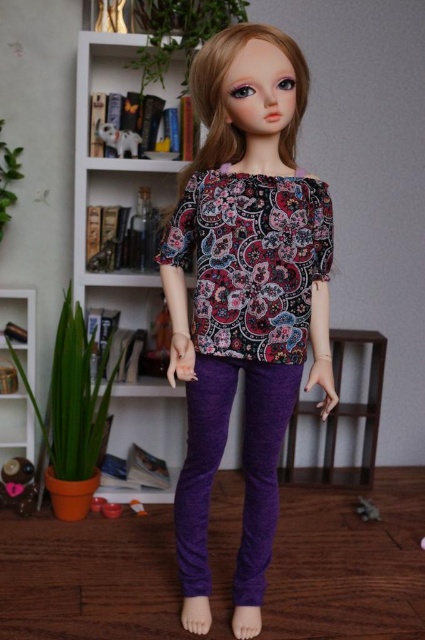
What are the coordinates of the matte floral blouse at center?

The matte floral blouse at center is located at point (244, 296).